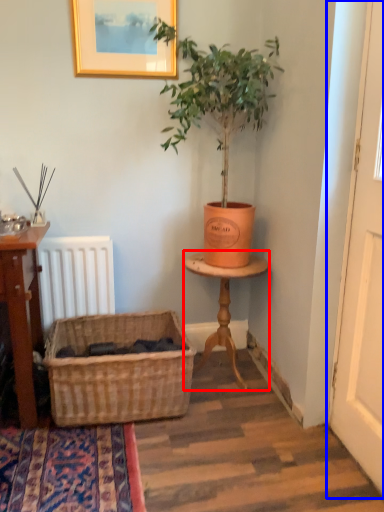
Question: Which object is further to the camera taking this photo, table (highlighted by a red box) or screen door (highlighted by a blue box)?

Choices:
 (A) table
 (B) screen door

Answer: (A)